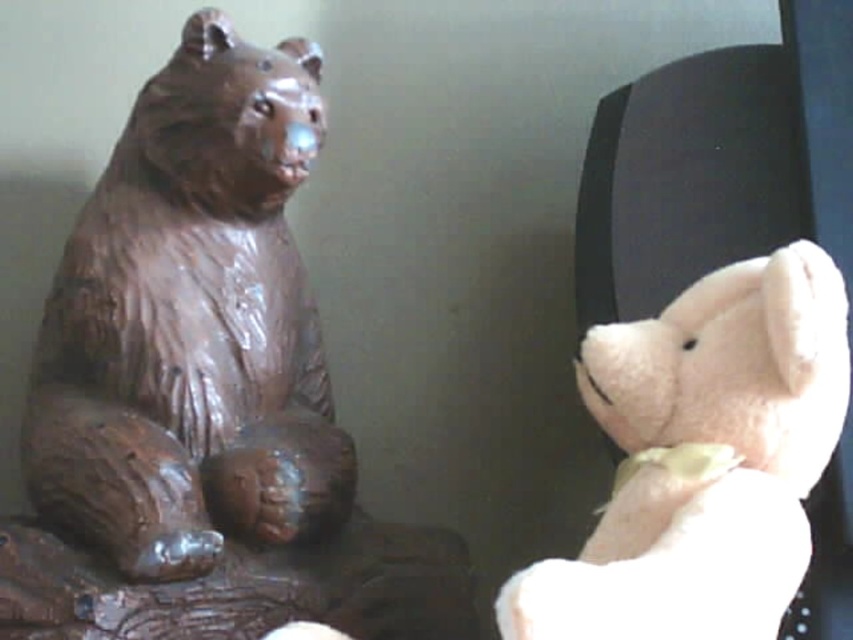
You are an interior designer arranging items on a shelf. You have the matte wood bear at left and the fluffy white teddy bear at right. The shelf has limited vertical space. Which bear should you place lower to avoid exceeding the shelf height limit?

The fluffy white teddy bear at right should be placed lower because the matte wood bear at left is located above it, meaning the wood bear takes up more vertical space.

You are an interior designer arranging a shelf. You have a matte wood bear at left and a fluffy white teddy bear at right. Which object requires more space on the shelf?

The matte wood bear at left requires more space on the shelf because it is bigger than the fluffy white teddy bear at right.

You are an interior designer arranging furniture in a living room. You have a matte wood bear at left and a fluffy white teddy bear at right. You want to place a small decorative vase between them. Can you place it directly in the middle between the two bears?

The fluffy white teddy bear at right is behind the matte wood bear at left, so there is no clear space in front to place the vase between them. You might need to adjust their positions first.